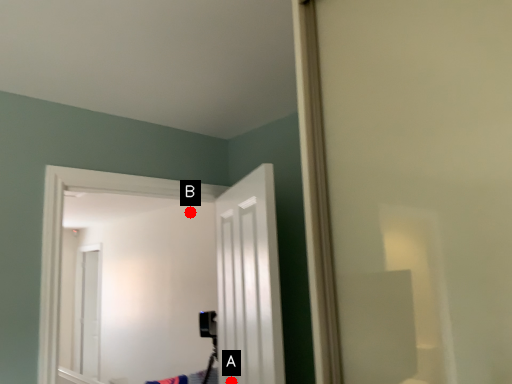
Question: Two points are circled on the image, labeled by A and B beside each circle. Which point is further to the camera?

Choices:
 (A) A is further
 (B) B is further

Answer: (B)